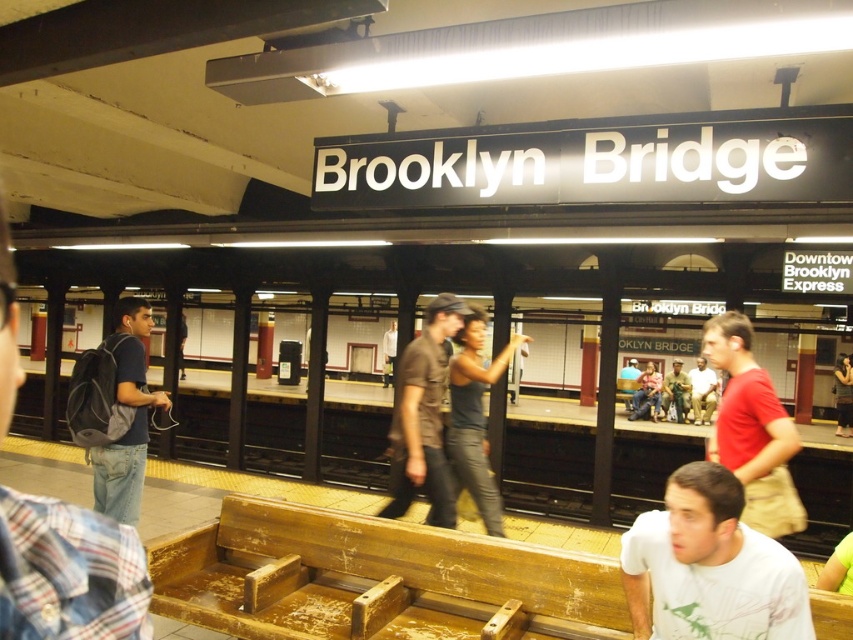
Is red cotton t-shirt at right closer to camera compared to dark gray jeans at center?

Yes, it is.

Can you confirm if red cotton t-shirt at right is wider than dark gray jeans at center?

No, red cotton t-shirt at right is not wider than dark gray jeans at center.

Who is more forward, (741, 324) or (480, 516)?

Point (741, 324)

The height and width of the screenshot is (640, 853). Identify the location of red cotton t-shirt at right. (752, 429).

Between dark blue jeans at left and dark gray jeans at center, which one has less height?

dark blue jeans at left

Which of these two, dark blue jeans at left or dark gray jeans at center, stands taller?

dark gray jeans at center

Is point (74, 561) farther from camera compared to point (480, 509)?

No, it is in front of (480, 509).

The image size is (853, 640). I want to click on dark blue jeans at left, so click(68, 572).

Does dark blue backpack at left have a greater height compared to camouflage fabric shirt at center?

Yes, dark blue backpack at left is taller than camouflage fabric shirt at center.

Is dark blue backpack at left bigger than camouflage fabric shirt at center?

Actually, dark blue backpack at left might be smaller than camouflage fabric shirt at center.

Is point (157, 394) positioned after point (679, 404)?

No.

Where is `dark blue backpack at left`? dark blue backpack at left is located at coordinates (132, 419).